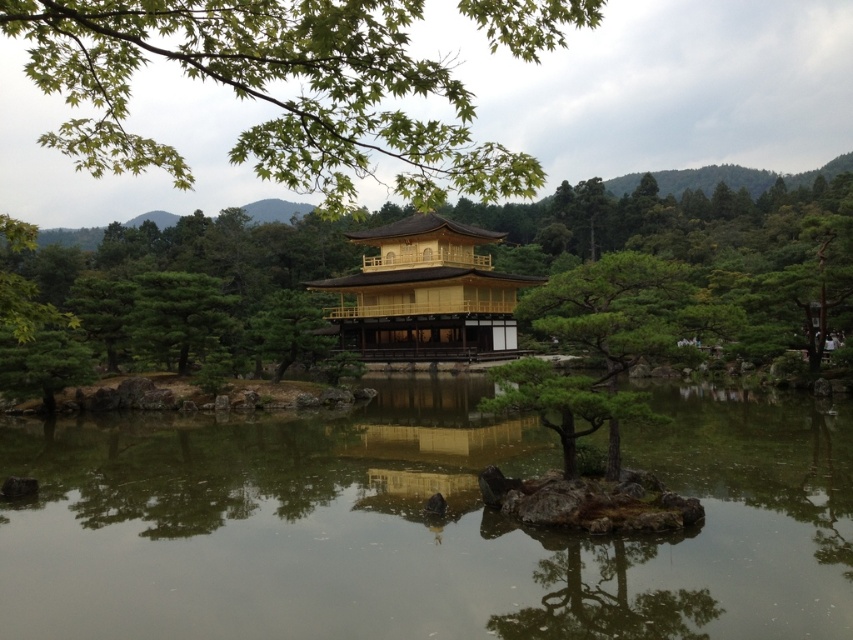
Who is lower down, green leafy branch at upper center or green matte tree at center?

green matte tree at center is lower down.

From the picture: Does green leafy branch at upper center have a larger size compared to green matte tree at center?

Correct, green leafy branch at upper center is larger in size than green matte tree at center.

Is point (399, 93) positioned before point (582, 388)?

Yes, point (399, 93) is in front of point (582, 388).

The width and height of the screenshot is (853, 640). I want to click on green leafy branch at upper center, so click(x=270, y=93).

In the scene shown: How far apart are golden polished wood temple at center and green matte tree at center?

The distance of golden polished wood temple at center from green matte tree at center is 63.89 feet.

Can you confirm if golden polished wood temple at center is positioned below green matte tree at center?

Actually, golden polished wood temple at center is above green matte tree at center.

Who is more forward, (403, 232) or (593, 337)?

Point (593, 337)

Locate an element on the screen. The height and width of the screenshot is (640, 853). golden polished wood temple at center is located at coordinates (426, 292).

Who is more distant from viewer, [689,195] or [372,282]?

The point [689,195] is more distant.

How much distance is there between green textured tree at center and golden polished wood temple at center?

green textured tree at center is 70.31 feet away from golden polished wood temple at center.

Who is more forward, (231, 266) or (489, 292)?

Positioned in front is point (489, 292).

Image resolution: width=853 pixels, height=640 pixels. Find the location of `green textured tree at center`. green textured tree at center is located at coordinates (662, 218).